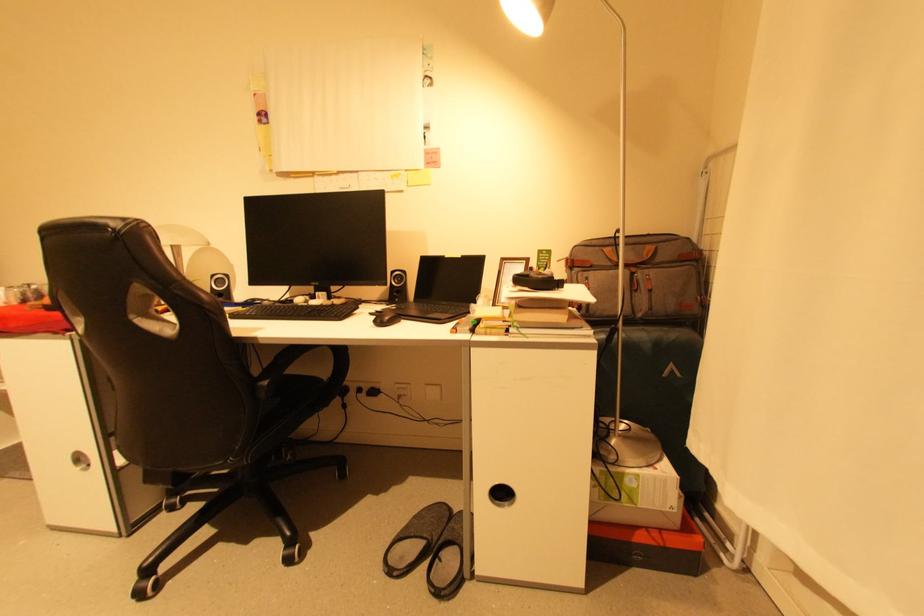
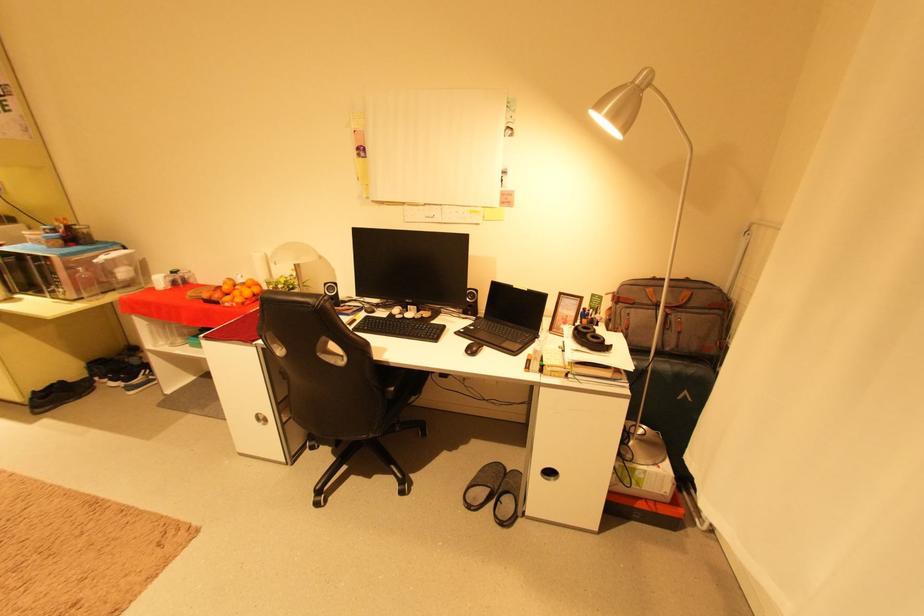
The point at (468, 257) is marked in the first image. Where is the corresponding point in the second image?

(533, 291)